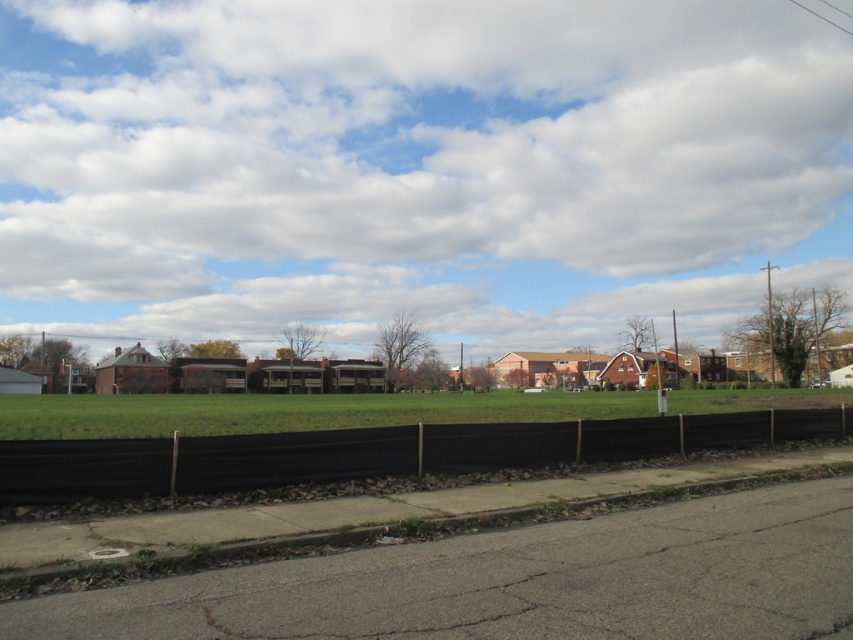
Who is higher up, white fluffy cloud at upper center or gray concrete curb at lower center?

Positioned higher is white fluffy cloud at upper center.

Is white fluffy cloud at upper center in front of gray concrete curb at lower center?

No, it is not.

Locate an element on the screen. This screenshot has width=853, height=640. white fluffy cloud at upper center is located at coordinates (415, 168).

Does black plastic fence at lower center have a lesser height compared to gray concrete curb at lower center?

No, black plastic fence at lower center is not shorter than gray concrete curb at lower center.

Does black plastic fence at lower center appear on the left side of gray concrete curb at lower center?

Incorrect, black plastic fence at lower center is not on the left side of gray concrete curb at lower center.

Does point (527, 445) lie in front of point (33, 579)?

No, it is behind (33, 579).

This screenshot has height=640, width=853. I want to click on black plastic fence at lower center, so click(378, 452).

Does white fluffy cloud at upper center come behind black plastic fence at lower center?

Yes, white fluffy cloud at upper center is further from the viewer.

Who is higher up, white fluffy cloud at upper center or black plastic fence at lower center?

white fluffy cloud at upper center

Identify the location of white fluffy cloud at upper center. (415, 168).